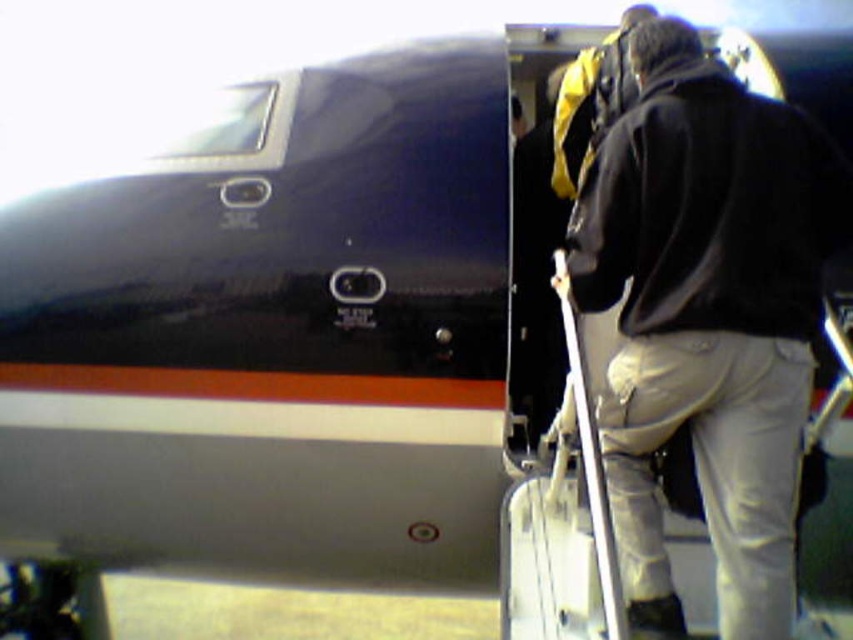
You are standing at the rear of the aircraft and want to move towards the open door. Which point, point (635, 419) or point (598, 627), is closer to the door?

Point (598, 627) is closer to the door because it is in front of point (635, 419).

You are a flight attendant on the private jet and need to store the black leather jacket at center and the white matte suitcase at center in the overhead compartment. Given the space available, which item should you place first to ensure both fit properly?

The black leather jacket at center is much taller than the white matte suitcase at center. To ensure both items fit in the overhead compartment, you should place the taller item, the black leather jacket at center, first, then the shorter white matte suitcase at center on top.

Based on the photo, you are standing at point 0.0, 0.0 in the image coordinate system. You need to reach the black leather jacket at center located at point (706, 317). What direction should you move in to get closer to it?

The black leather jacket at center is located at point (706, 317). Since you are at 0.0, 0.0, you should move in the positive x and positive y direction to reach it.